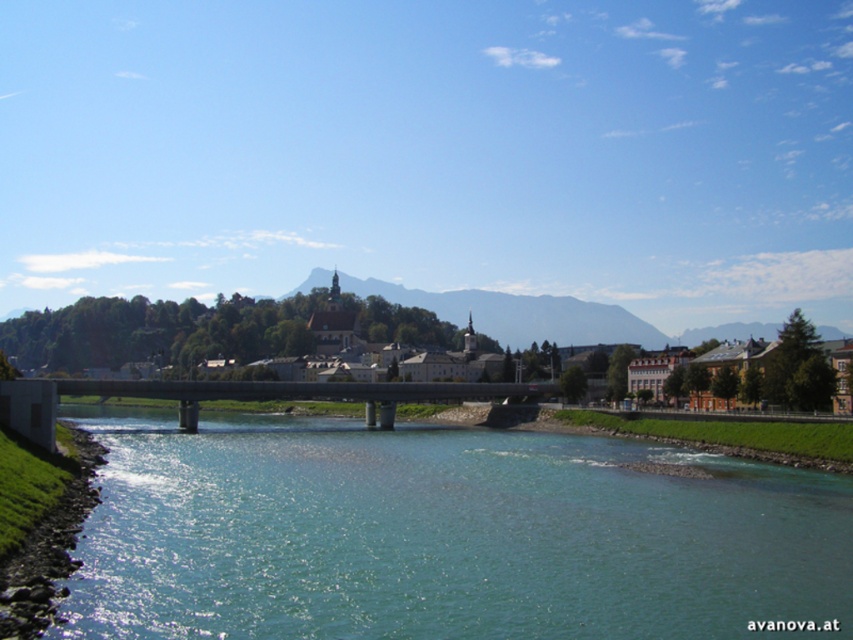
Is clear water at center above concrete bridge at center?

No.

Between point (581, 518) and point (163, 397), which one is positioned behind?

The point (163, 397) is behind.

You are a GUI agent. You are given a task and a screenshot of the screen. Output one action in this format:
    pyautogui.click(x=<x>, y=<y>)
    Task: Click on the clear water at center
    
    Given the screenshot: What is the action you would take?
    pyautogui.click(x=445, y=536)

Can you confirm if clear water at center is thinner than matte stone bridge at center?

Yes.

This screenshot has height=640, width=853. Describe the element at coordinates (445, 536) in the screenshot. I see `clear water at center` at that location.

Find the location of a particular element. clear water at center is located at coordinates (445, 536).

Which of these two, matte stone bridge at center or concrete bridge at center, stands taller?

matte stone bridge at center

Can you confirm if matte stone bridge at center is shorter than concrete bridge at center?

Incorrect, matte stone bridge at center's height does not fall short of concrete bridge at center's.

Who is more forward, (74, 305) or (544, 388)?

Positioned in front is point (544, 388).

At what (x,y) coordinates should I click in order to perform the action: click on matte stone bridge at center. Please return your answer as a coordinate pair (x, y). The height and width of the screenshot is (640, 853). Looking at the image, I should click on (207, 330).